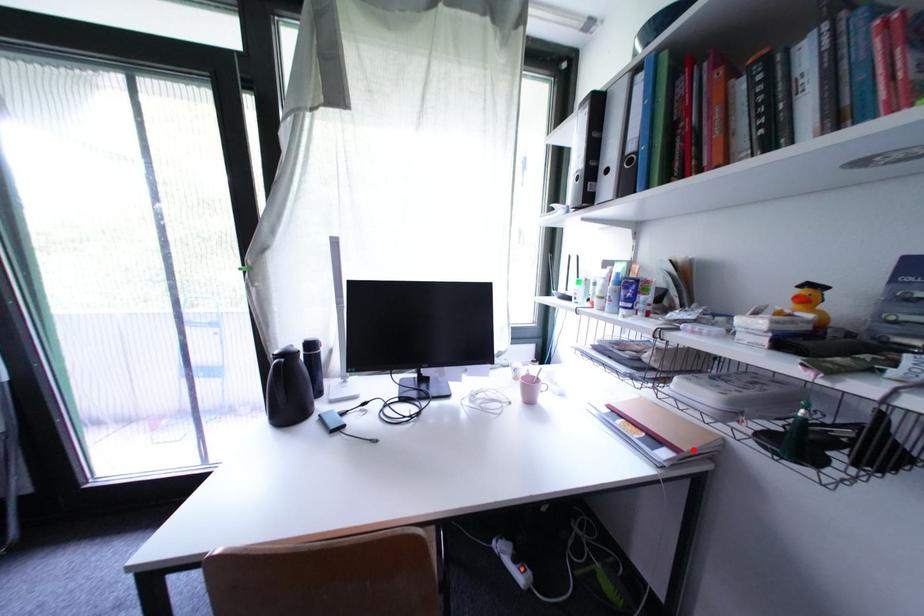
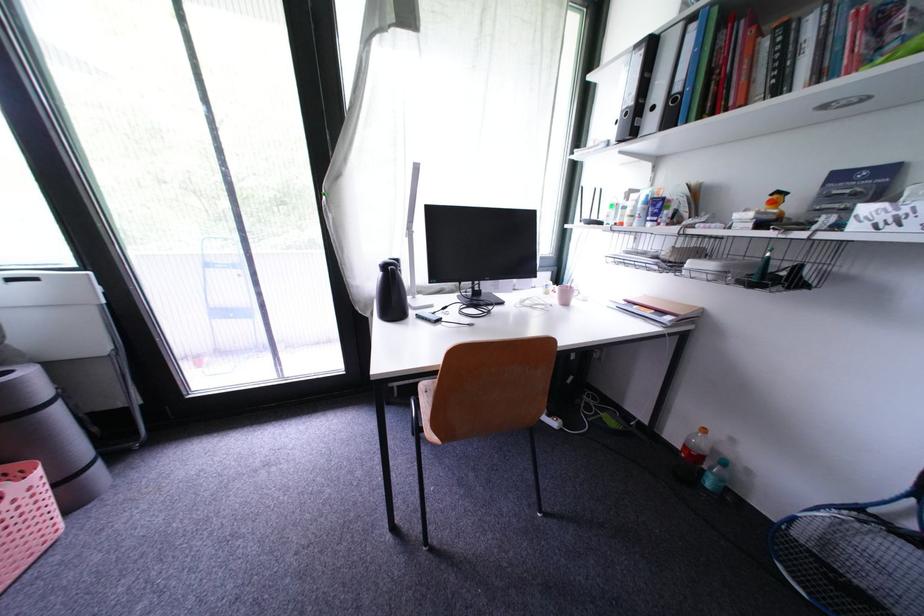
Where in the second image is the point corresponding to the highlighted location from the first image?

(689, 315)